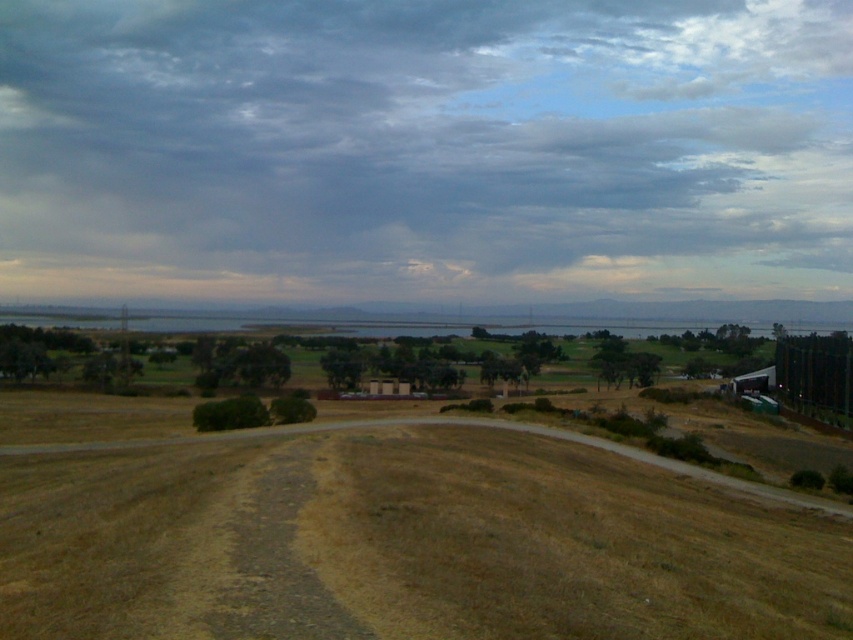
Question: Which of the following is the closest to the observer?

Choices:
 (A) (428, 289)
 (B) (706, 324)

Answer: (A)

Question: In this image, where is brown dry grass at lower center located relative to smooth asphalt road at center?

Choices:
 (A) above
 (B) below

Answer: (B)

Question: Among these points, which one is farthest from the camera?

Choices:
 (A) (76, 284)
 (B) (204, 500)
 (C) (718, 314)

Answer: (C)

Question: Can you confirm if brown dry grass at lower center is positioned to the left of smooth asphalt road at center?

Choices:
 (A) yes
 (B) no

Answer: (A)

Question: Which of the following is the closest to the observer?

Choices:
 (A) (352, 483)
 (B) (689, 212)
 (C) (187, 317)

Answer: (A)

Question: Can you confirm if cloudy sky at upper center is thinner than smooth asphalt road at center?

Choices:
 (A) no
 (B) yes

Answer: (A)